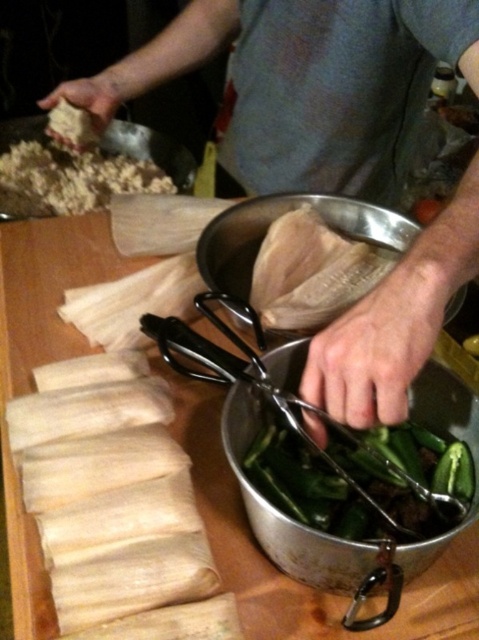
Question: Which point is closer to the camera taking this photo?

Choices:
 (A) (1, 282)
 (B) (55, 128)
 (C) (303, 136)
 (D) (227, 385)

Answer: (D)

Question: Among these objects, which one is farthest from the camera?

Choices:
 (A) white crumbly dough at upper left
 (B) white paper at center
 (C) black metal tongs at center
 (D) brown crumbly at upper left

Answer: (D)

Question: Which of the following is the closest to the observer?

Choices:
 (A) (368, 524)
 (B) (81, 141)
 (C) (102, 248)
 (D) (37, 186)

Answer: (A)

Question: Can you confirm if wooden cutting board at center is bigger than white crumbly dough at upper left?

Choices:
 (A) no
 (B) yes

Answer: (B)

Question: Is white paper at center thinner than wooden cutting board at center?

Choices:
 (A) yes
 (B) no

Answer: (A)

Question: Does black metal tongs at center have a larger size compared to wooden cutting board at center?

Choices:
 (A) no
 (B) yes

Answer: (A)